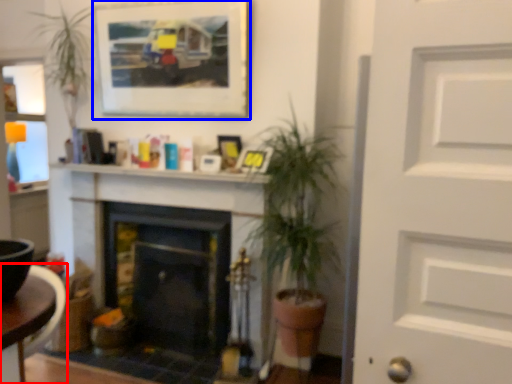
Question: Among these objects, which one is farthest to the camera, table (highlighted by a red box) or picture frame (highlighted by a blue box)?

Choices:
 (A) table
 (B) picture frame

Answer: (B)